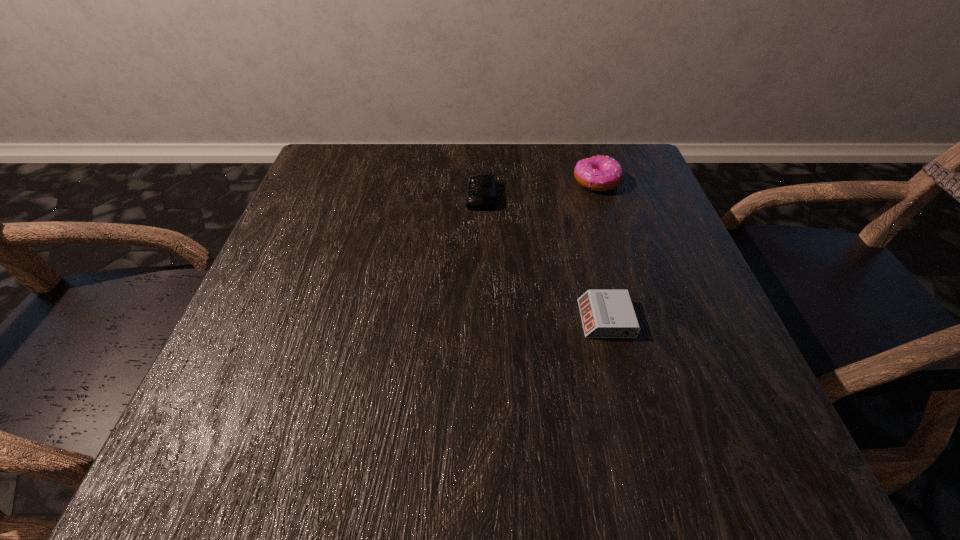
You are a GUI agent. You are given a task and a screenshot of the screen. Output one action in this format:
    pyautogui.click(x=<x>, y=<y>)
    Task: Click on the doughnut that is at the far edge
    The height and width of the screenshot is (540, 960).
    Given the screenshot: What is the action you would take?
    pos(601,173)

Find the location of `alarm clock located at the far edge`. alarm clock located at the far edge is located at coordinates (480, 194).

This screenshot has width=960, height=540. What are the coordinates of `doughnut situated at the right edge` in the screenshot? It's located at (601, 173).

Where is `alarm clock located in the right edge section of the desktop`? alarm clock located in the right edge section of the desktop is located at coordinates (605, 313).

Locate an element on the screen. This screenshot has height=540, width=960. object that is at the far right corner is located at coordinates (601, 173).

You are a GUI agent. You are given a task and a screenshot of the screen. Output one action in this format:
    pyautogui.click(x=<x>, y=<y>)
    Task: Click on the vacant space at the far edge of the desktop
    The height and width of the screenshot is (540, 960).
    Given the screenshot: What is the action you would take?
    pyautogui.click(x=411, y=152)

In the image, there is a desktop. At what (x,y) coordinates should I click in order to perform the action: click on vacant space at the near edge. Please return your answer as a coordinate pair (x, y). This screenshot has width=960, height=540. Looking at the image, I should click on (618, 480).

At what (x,y) coordinates should I click in order to perform the action: click on blank space at the left edge of the desktop. Please return your answer as a coordinate pair (x, y). This screenshot has width=960, height=540. Looking at the image, I should click on (322, 204).

The height and width of the screenshot is (540, 960). What are the coordinates of `vacant space at the right edge of the desktop` in the screenshot? It's located at (609, 232).

Where is `vacant space at the far left corner`? vacant space at the far left corner is located at coordinates (359, 167).